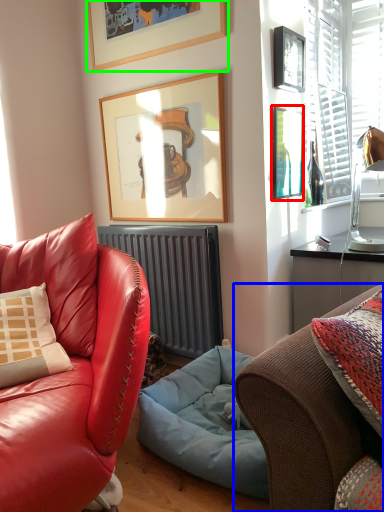
Question: Estimate the real-world distances between objects in this image. Which object is closer to picture frame (highlighted by a red box), studio couch (highlighted by a blue box) or picture frame (highlighted by a green box)?

Choices:
 (A) studio couch
 (B) picture frame

Answer: (B)